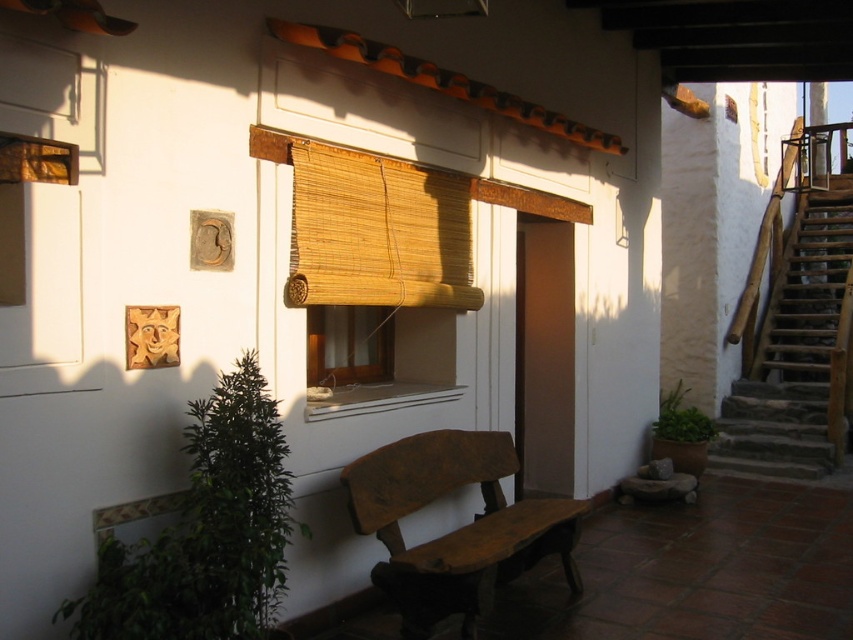
Question: From the image, what is the correct spatial relationship of green leafy plant at lower left in relation to dark brown wooden bench at center?

Choices:
 (A) right
 (B) left

Answer: (B)

Question: Estimate the real-world distances between objects in this image. Which object is closer to the dark brown wooden bench at center?

Choices:
 (A) green leafy plant at lower left
 (B) green leafy plant at center

Answer: (A)

Question: Which point appears closest to the camera in this image?

Choices:
 (A) (693, 420)
 (B) (113, 580)
 (C) (332, 230)

Answer: (B)

Question: Does green leafy plant at lower left come behind dark brown wooden bench at center?

Choices:
 (A) no
 (B) yes

Answer: (A)

Question: Does green leafy plant at lower left come behind bamboo mat at center?

Choices:
 (A) yes
 (B) no

Answer: (B)

Question: Among these points, which one is farthest from the camera?

Choices:
 (A) (848, 218)
 (B) (296, 189)

Answer: (A)